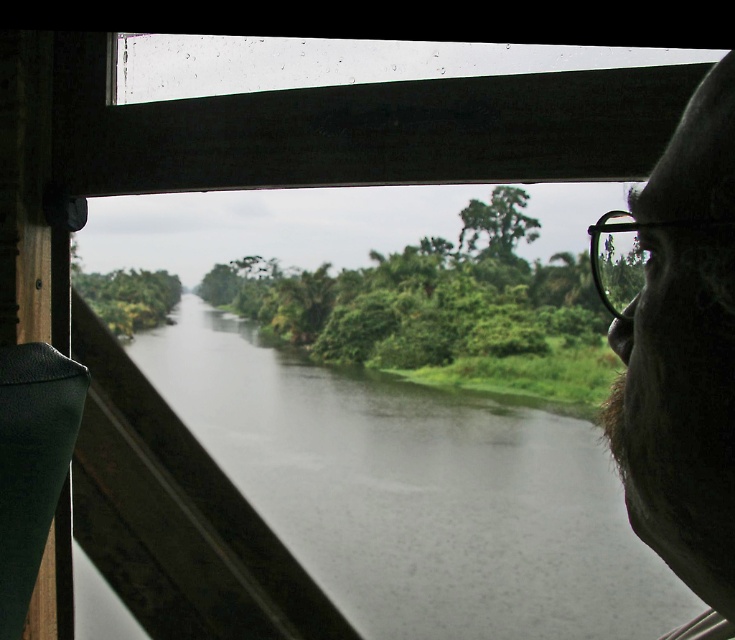
Can you confirm if dark gray water at center is bigger than dark brown fur at right?

Indeed, dark gray water at center has a larger size compared to dark brown fur at right.

Which is above, dark gray water at center or dark brown fur at right?

dark brown fur at right is above.

In order to click on dark gray water at center in this screenshot , I will do `click(415, 493)`.